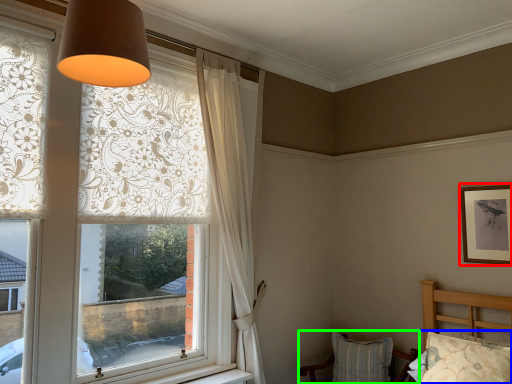
Question: Considering the real-world distances, which object is farthest from picture frame (highlighted by a red box)? pillow (highlighted by a blue box) or chair (highlighted by a green box)?

Choices:
 (A) pillow
 (B) chair

Answer: (B)